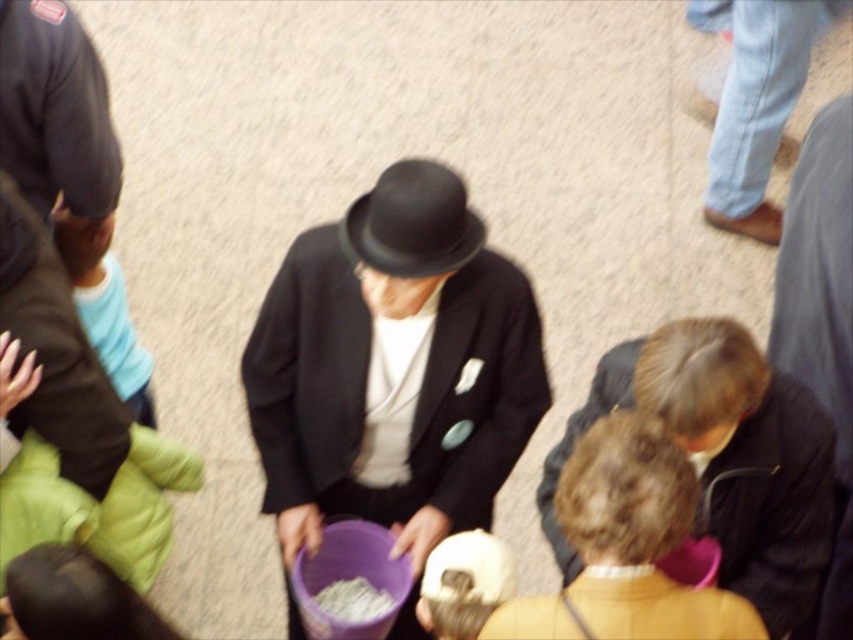
Question: Is matte yellow sweater at center thinner than light blue denim jeans at upper right?

Choices:
 (A) yes
 (B) no

Answer: (B)

Question: Which of the following is the closest to the observer?

Choices:
 (A) (401, 252)
 (B) (602, 500)
 (C) (384, 323)
 (D) (786, 49)

Answer: (B)

Question: Is matte black hat at center positioned in front of light blue denim jeans at upper right?

Choices:
 (A) yes
 (B) no

Answer: (A)

Question: Is light blue denim jeans at upper right further to camera compared to white crumbly food at center?

Choices:
 (A) no
 (B) yes

Answer: (B)

Question: Which object appears farthest from the camera in this image?

Choices:
 (A) white crumbly food at center
 (B) matte black hat at center

Answer: (A)

Question: Which of these objects is positioned farthest from the matte black hat at center?

Choices:
 (A) light blue denim jeans at upper right
 (B) matte yellow sweater at center
 (C) black felt hat at center

Answer: (A)